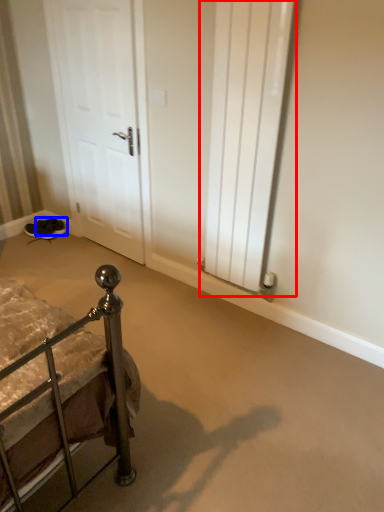
Question: Among these objects, which one is farthest to the camera, radiator (highlighted by a red box) or footwear (highlighted by a blue box)?

Choices:
 (A) radiator
 (B) footwear

Answer: (B)